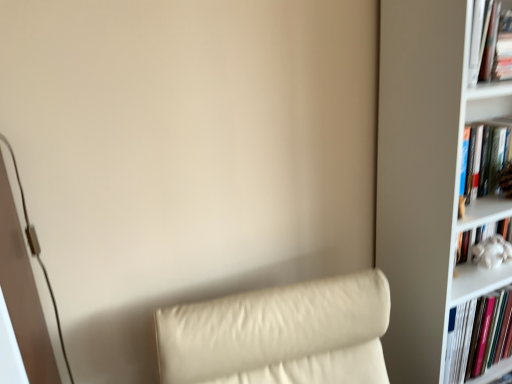
Question: Does hardcover book at upper right, marked as the first book in a top-to-bottom arrangement, appear on the left side of white matte bookcase at right?

Choices:
 (A) no
 (B) yes

Answer: (B)

Question: From a real-world perspective, is hardcover book at upper right, marked as the first book in a top-to-bottom arrangement, physically above white matte bookcase at right?

Choices:
 (A) no
 (B) yes

Answer: (B)

Question: Can you confirm if hardcover book at upper right, which is counted as the 4th book, starting from the bottom, is bigger than white matte bookcase at right?

Choices:
 (A) yes
 (B) no

Answer: (B)

Question: From the image's perspective, is hardcover book at upper right, which is counted as the 4th book, starting from the bottom, located beneath white matte bookcase at right?

Choices:
 (A) yes
 (B) no

Answer: (B)

Question: Is hardcover book at upper right, marked as the first book in a top-to-bottom arrangement, wider than white matte bookcase at right?

Choices:
 (A) yes
 (B) no

Answer: (B)

Question: Could you tell me if hardcover book at upper right, marked as the first book in a top-to-bottom arrangement, is facing white matte bookcase at right?

Choices:
 (A) no
 (B) yes

Answer: (B)

Question: Would you say hardcover book at upper right, which is counted as the 4th book, starting from the bottom, contains white fluffy toy at right, the third book from the top?

Choices:
 (A) no
 (B) yes

Answer: (A)

Question: Does hardcover book at upper right, which is counted as the 4th book, starting from the bottom, have a lesser width compared to white fluffy toy at right, the second book positioned from the bottom?

Choices:
 (A) no
 (B) yes

Answer: (B)

Question: Considering the relative positions of hardcover book at upper right, marked as the first book in a top-to-bottom arrangement, and white fluffy toy at right, the third book from the top, in the image provided, is hardcover book at upper right, marked as the first book in a top-to-bottom arrangement, to the left of white fluffy toy at right, the third book from the top, from the viewer's perspective?

Choices:
 (A) no
 (B) yes

Answer: (A)

Question: Is hardcover book at upper right, marked as the first book in a top-to-bottom arrangement, not inside white fluffy toy at right, the second book positioned from the bottom?

Choices:
 (A) yes
 (B) no

Answer: (A)

Question: From the image's perspective, would you say hardcover book at upper right, which is counted as the 4th book, starting from the bottom, is shown under white fluffy toy at right, the third book from the top?

Choices:
 (A) yes
 (B) no

Answer: (B)

Question: Is hardcover book at upper right, which is counted as the 4th book, starting from the bottom, not near white fluffy toy at right, the third book from the top?

Choices:
 (A) yes
 (B) no

Answer: (B)

Question: From a real-world perspective, is white matte bookcase at right on hardcover book at right, the 4th book from the top?

Choices:
 (A) no
 (B) yes

Answer: (B)